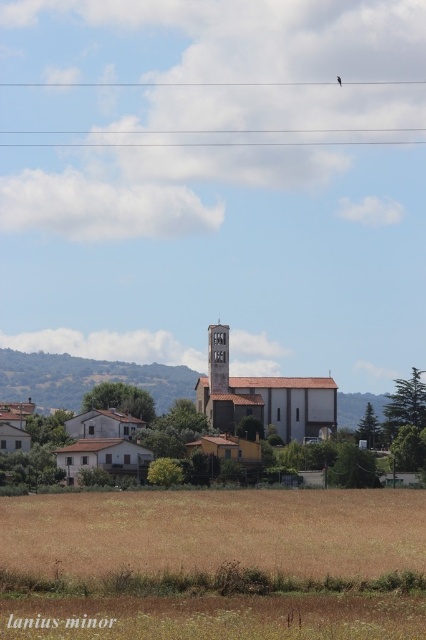
Question: Which object is positioned farthest from the brown grassland at lower center?

Choices:
 (A) rustic stone bell tower at center
 (B) clear plastic wire at upper center

Answer: (B)

Question: Is brown grassland at lower center bigger than rustic stone bell tower at center?

Choices:
 (A) yes
 (B) no

Answer: (A)

Question: Is brown grassland at lower center positioned before rustic stone bell tower at center?

Choices:
 (A) no
 (B) yes

Answer: (B)

Question: Which point appears closest to the camera in this image?

Choices:
 (A) (339, 128)
 (B) (212, 324)
 (C) (236, 520)

Answer: (C)

Question: Considering the real-world distances, which object is farthest from the clear plastic wire at upper center?

Choices:
 (A) brown grassland at lower center
 (B) rustic stone bell tower at center

Answer: (A)

Question: Where is brown grassland at lower center located in relation to rustic stone bell tower at center in the image?

Choices:
 (A) left
 (B) right

Answer: (A)